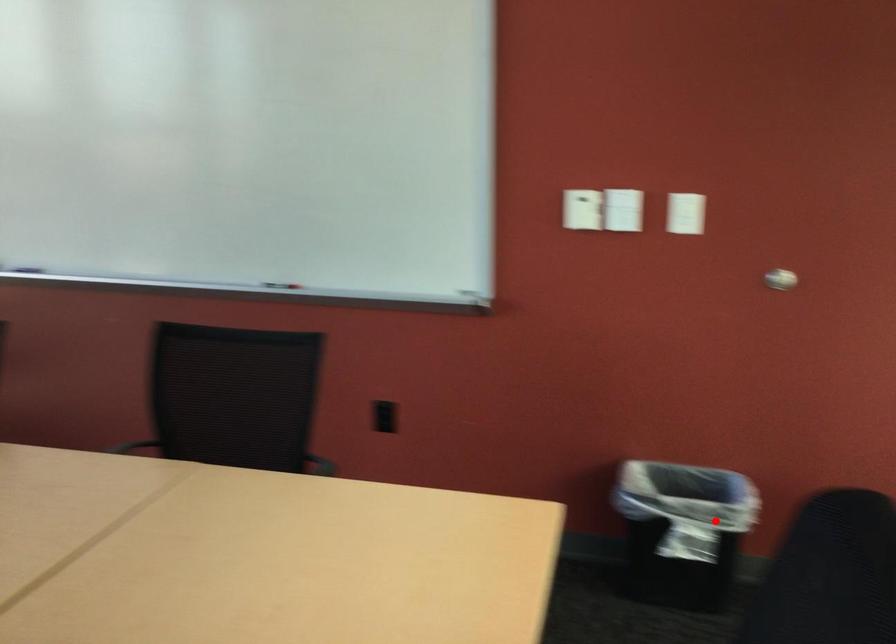
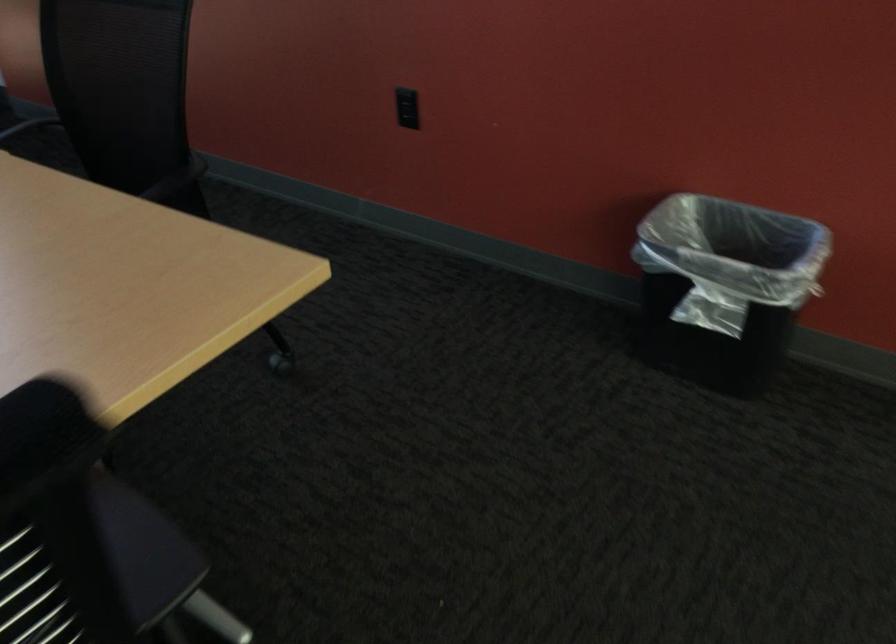
Question: I am providing you with two images of the same scene from different viewpoints. Image1 has a red point marked. In image2, the corresponding 3D location appears at what relative position? Reply with the corresponding letter.

Choices:
 (A) Closer
 (B) Farther

Answer: (A)